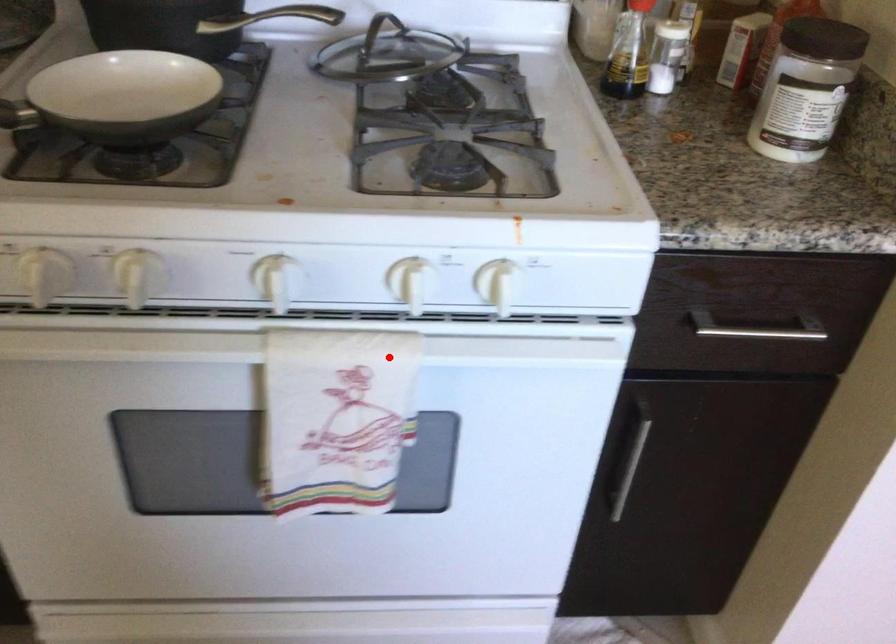
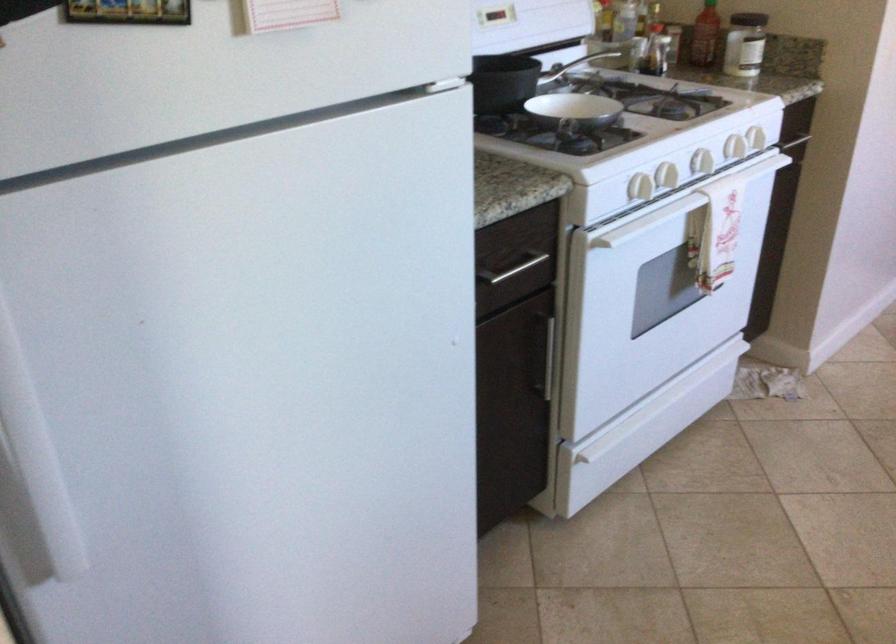
Where in the second image is the point corresponding to the highlighted location from the first image?

(755, 138)